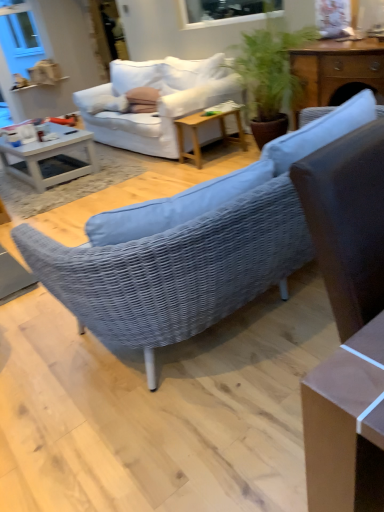
Question: Would you say wooden cabinet at upper right, the 1th table positioned from the front, is to the left or to the right of white glossy coffee table at left in the picture?

Choices:
 (A) right
 (B) left

Answer: (A)

Question: In terms of height, does wooden cabinet at upper right, which ranks as the second table in left-to-right order, look taller or shorter compared to white glossy coffee table at left?

Choices:
 (A) tall
 (B) short

Answer: (A)

Question: Which is nearer to the wooden side table at center, the 1th table when ordered from left to right?

Choices:
 (A) woven fabric studio couch at center, which is counted as the second studio couch, starting from the right
 (B) white plastic window screen at upper center
 (C) wooden cabinet at upper right, the first table positioned from the right
 (D) white glossy coffee table at left
 (E) matte pink pillow at center

Answer: (E)

Question: Estimate the real-world distances between objects in this image. Which object is farther from the wooden cabinet at upper right, the second table from the back?

Choices:
 (A) white fabric studio couch at upper center, which ranks as the second studio couch in left-to-right order
 (B) matte pink pillow at center
 (C) wooden side table at center, the 1th table when ordered from left to right
 (D) white plastic window screen at upper center
 (E) white glossy coffee table at left

Answer: (E)